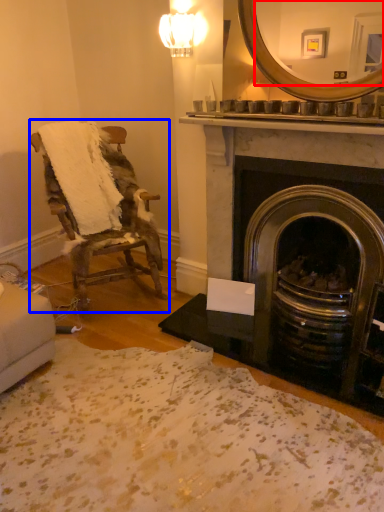
Question: Which object appears closest to the camera in this image, mirror (highlighted by a red box) or chair (highlighted by a blue box)?

Choices:
 (A) mirror
 (B) chair

Answer: (A)